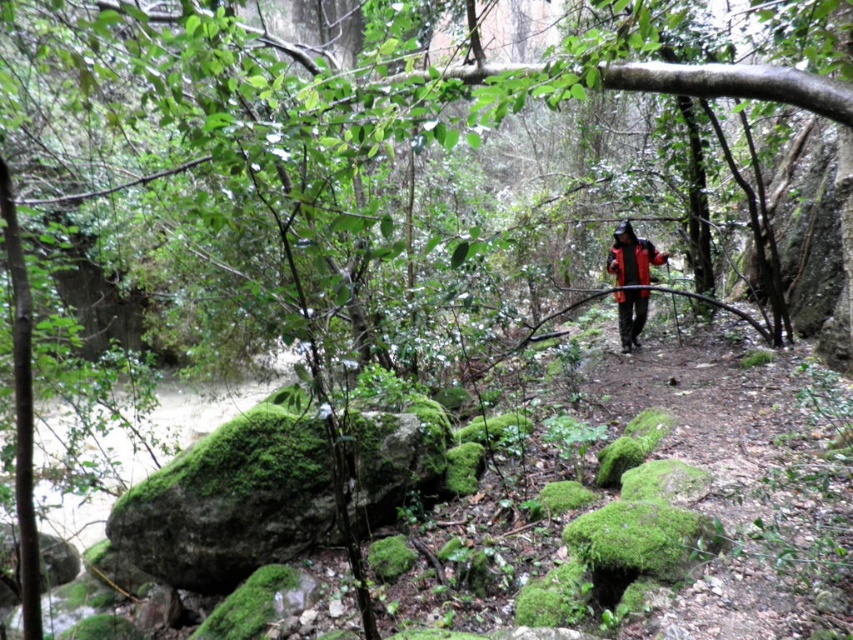
Can you confirm if green mossy rock at lower left is smaller than red matte jacket at center?

Actually, green mossy rock at lower left might be larger than red matte jacket at center.

Measure the distance between green mossy rock at lower left and camera.

A distance of 4.61 meters exists between green mossy rock at lower left and camera.

Find the location of a particular element. This screenshot has height=640, width=853. green mossy rock at lower left is located at coordinates (230, 502).

Identify the location of green mossy rock at lower left. (230, 502).